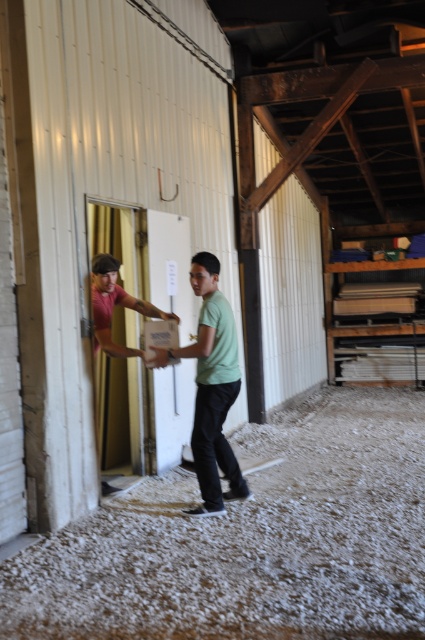
You are a delivery person who needs to walk across the white gravel at lower center to reach the matte pink shirt at left. Considering the size of the gravel, will it be easy to walk on?

The white gravel at lower center has a smaller size compared to matte pink shirt at left, so the gravel is small and likely easier to walk on without sinking or causing discomfort.

You are standing in the warehouse and want to walk towards the white gravel at lower center. However, there is a matte pink shirt at left in your path. Which object will you encounter first?

You will encounter the white gravel at lower center first because it is closer to the viewer than the matte pink shirt at left.

You are a security guard observing the warehouse scene. You need to determine who is closer to the door with a metallic frame. Based on the positions of the green matte shirt at center and the matte pink shirt at left, which person is nearer to the door?

The green matte shirt at center is in front of the matte pink shirt at left, so the green matte shirt at center is closer to the door with a metallic frame.